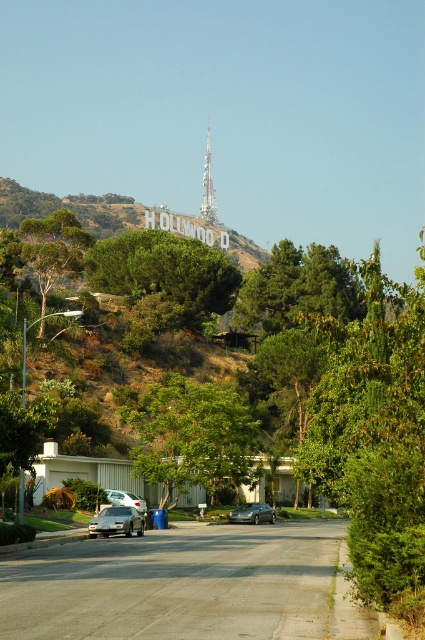
Identify the location of green leafy tree at center. The height and width of the screenshot is (640, 425). (190, 436).

Which of these two, green leafy tree at center or green leafy tree at left, stands taller?

green leafy tree at left

Is point (212, 474) in front of point (19, 256)?

Yes, point (212, 474) is closer to viewer.

Where is `green leafy tree at center`? green leafy tree at center is located at coordinates (190, 436).

Can you confirm if green leafy tree at center is smaller than silver metallic tower at upper center?

Correct, green leafy tree at center occupies less space than silver metallic tower at upper center.

Which is more to the left, green leafy tree at center or silver metallic tower at upper center?

From the viewer's perspective, silver metallic tower at upper center appears more on the left side.

Is point (240, 413) more distant than point (203, 196)?

That is False.

Locate an element on the screen. Image resolution: width=425 pixels, height=640 pixels. green leafy tree at center is located at coordinates (190, 436).

Can you confirm if green leafy tree at left is wider than silver metallic tower at upper center?

Yes.

Is point (25, 260) closer to viewer compared to point (206, 193)?

That is True.

Does point (42, 220) lie in front of point (210, 209)?

Yes, it is.

You are a GUI agent. You are given a task and a screenshot of the screen. Output one action in this format:
    pyautogui.click(x=<x>, y=<y>)
    Task: Click on the green leafy tree at left
    
    Given the screenshot: What is the action you would take?
    pyautogui.click(x=47, y=250)